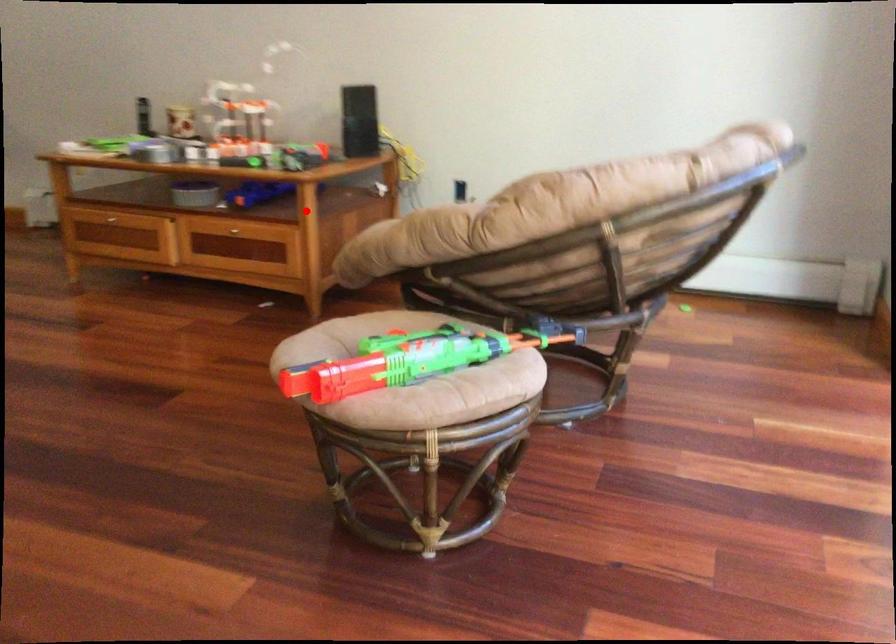
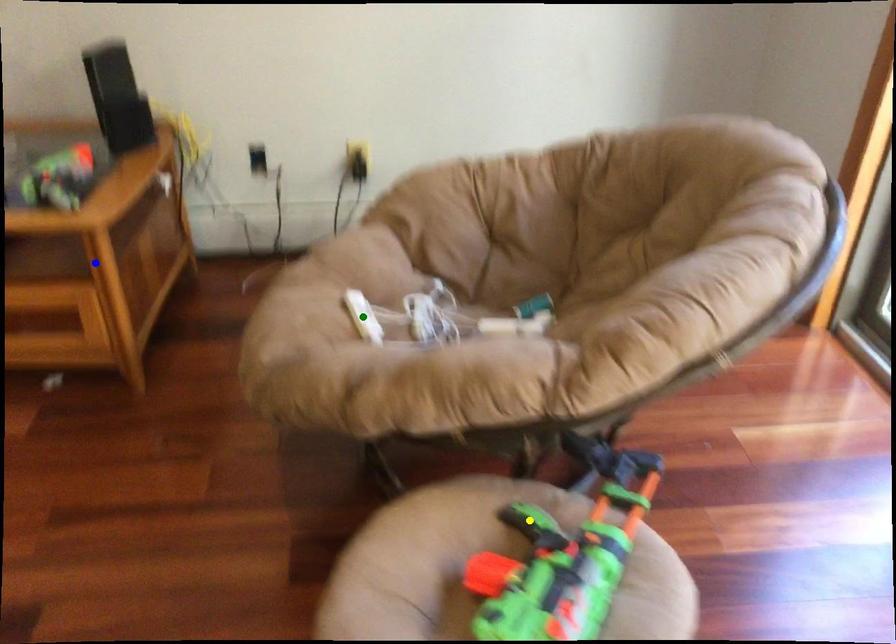
Question: I am providing you with two images of the same scene from different viewpoints. A red point is marked on the first image. You are given multiple points on the second image. Can you choose the point in image 2 that corresponds to the point in image 1?

Choices:
 (A) green point
 (B) blue point
 (C) yellow point

Answer: (B)